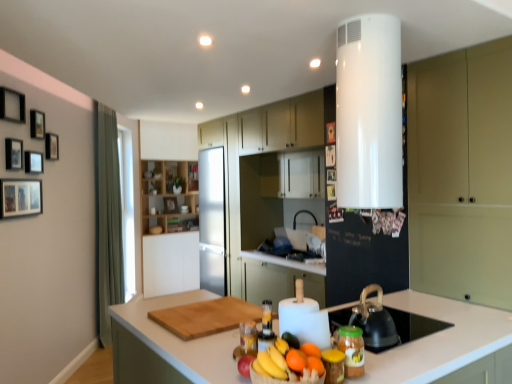
Question: Considering the relative positions of wooden picture frame at upper center, marked as the fifth picture frame in a back-to-front arrangement, and wooden picture frame at upper center, which is counted as the eighth picture frame, starting from the front, in the image provided, is wooden picture frame at upper center, marked as the fifth picture frame in a back-to-front arrangement, behind wooden picture frame at upper center, which is counted as the eighth picture frame, starting from the front,?

Choices:
 (A) no
 (B) yes

Answer: (A)

Question: Is wooden picture frame at upper center, marked as the fourth picture frame in a right-to-left arrangement, oriented away from wooden picture frame at upper center, the fourth picture frame when ordered from back to front?

Choices:
 (A) yes
 (B) no

Answer: (B)

Question: Would you say wooden picture frame at upper center, marked as the fifth picture frame in a back-to-front arrangement, is outside wooden picture frame at upper center, arranged as the tenth picture frame when viewed from the left?

Choices:
 (A) yes
 (B) no

Answer: (A)

Question: Are wooden picture frame at upper center, marked as the 7th picture frame in a front-to-back arrangement, and wooden picture frame at upper center, which is counted as the eighth picture frame, starting from the front, making contact?

Choices:
 (A) no
 (B) yes

Answer: (A)

Question: From a real-world perspective, is wooden picture frame at upper center, the 8th picture frame in the left-to-right sequence, below wooden picture frame at upper center, which is counted as the eighth picture frame, starting from the front?

Choices:
 (A) yes
 (B) no

Answer: (B)

Question: From a real-world perspective, relative to wooden picture frame at upper left, which is the fourth picture frame from front to back, is wooden picture frame at upper center, marked as the fifth picture frame in a back-to-front arrangement, vertically above or below?

Choices:
 (A) above
 (B) below

Answer: (A)

Question: Is wooden picture frame at upper center, marked as the fifth picture frame in a back-to-front arrangement, to the left or to the right of wooden picture frame at upper left, the eighth picture frame in the back-to-front sequence, in the image?

Choices:
 (A) right
 (B) left

Answer: (A)

Question: Looking at their shapes, would you say wooden picture frame at upper center, marked as the fifth picture frame in a back-to-front arrangement, is wider or thinner than wooden picture frame at upper left, the 8th picture frame positioned from the right?

Choices:
 (A) thin
 (B) wide

Answer: (A)

Question: From the image's perspective, is wooden picture frame at upper center, marked as the fourth picture frame in a right-to-left arrangement, above or below wooden picture frame at upper left, the eighth picture frame in the back-to-front sequence?

Choices:
 (A) above
 (B) below

Answer: (A)

Question: Is wooden picture frame at upper center, the fourth picture frame when ordered from back to front, to the left or to the right of white glossy countertop at center in the image?

Choices:
 (A) left
 (B) right

Answer: (B)

Question: Which is correct: wooden picture frame at upper center, the fourth picture frame when ordered from back to front, is inside white glossy countertop at center, or outside of it?

Choices:
 (A) outside
 (B) inside

Answer: (A)

Question: From the image's perspective, is wooden picture frame at upper center, the fourth picture frame when ordered from back to front, above or below white glossy countertop at center?

Choices:
 (A) below
 (B) above

Answer: (B)

Question: From a real-world perspective, is wooden picture frame at upper center, arranged as the tenth picture frame when viewed from the left, physically located above or below white glossy countertop at center?

Choices:
 (A) below
 (B) above

Answer: (B)

Question: From the image's perspective, is white glossy water heater at upper center located above or below wooden shelves at center, marked as the fourth cabinetry in a right-to-left arrangement?

Choices:
 (A) below
 (B) above

Answer: (B)

Question: Is white glossy water heater at upper center bigger or smaller than wooden shelves at center, marked as the fourth cabinetry in a right-to-left arrangement?

Choices:
 (A) small
 (B) big

Answer: (A)